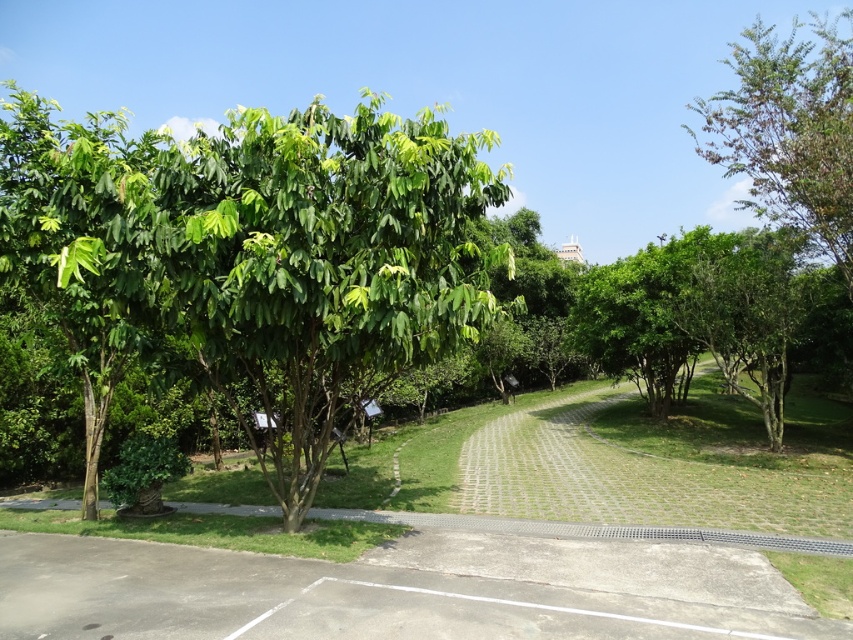
You are a gardener planning to trim the trees in the park. You need to know which tree requires more attention due to its size. Which tree is taller between the green leafy tree at center and the green leafy tree at upper right?

The green leafy tree at upper right is taller than the green leafy tree at center, so it requires more attention due to its size.